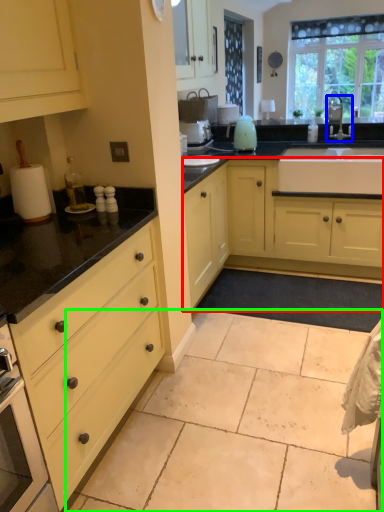
Question: Which is nearer to the cabinetry (highlighted by a red box)? tap (highlighted by a blue box) or granite (highlighted by a green box).

Choices:
 (A) tap
 (B) granite

Answer: (B)